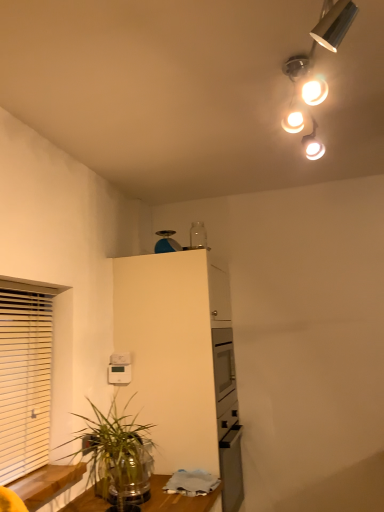
Question: Can you confirm if white wooden blinds at left is positioned to the right of white matte cabinet at upper center?

Choices:
 (A) no
 (B) yes

Answer: (A)

Question: From a real-world perspective, is white wooden blinds at left on top of white matte cabinet at upper center?

Choices:
 (A) no
 (B) yes

Answer: (B)

Question: Considering the relative sizes of white wooden blinds at left and white matte cabinet at upper center in the image provided, is white wooden blinds at left shorter than white matte cabinet at upper center?

Choices:
 (A) yes
 (B) no

Answer: (A)

Question: Does white wooden blinds at left lie behind white matte cabinet at upper center?

Choices:
 (A) yes
 (B) no

Answer: (B)

Question: Considering the relative sizes of white wooden blinds at left and white matte cabinet at upper center in the image provided, is white wooden blinds at left wider than white matte cabinet at upper center?

Choices:
 (A) no
 (B) yes

Answer: (A)

Question: Could you tell me if white wooden blinds at left is facing white matte cabinet at upper center?

Choices:
 (A) yes
 (B) no

Answer: (B)

Question: From the image's perspective, does blue plastic scale at upper center appear lower than white matte cabinet at upper center?

Choices:
 (A) yes
 (B) no

Answer: (B)

Question: Is the depth of blue plastic scale at upper center greater than that of white matte cabinet at upper center?

Choices:
 (A) yes
 (B) no

Answer: (A)

Question: Is blue plastic scale at upper center positioned with its back to white matte cabinet at upper center?

Choices:
 (A) yes
 (B) no

Answer: (B)

Question: Can you confirm if blue plastic scale at upper center is positioned to the right of white matte cabinet at upper center?

Choices:
 (A) yes
 (B) no

Answer: (B)

Question: Does blue plastic scale at upper center have a larger size compared to white matte cabinet at upper center?

Choices:
 (A) yes
 (B) no

Answer: (B)

Question: Does blue plastic scale at upper center have a smaller size compared to white matte cabinet at upper center?

Choices:
 (A) no
 (B) yes

Answer: (B)

Question: Would you say green leafy plant at lower left is outside blue plastic scale at upper center?

Choices:
 (A) yes
 (B) no

Answer: (A)